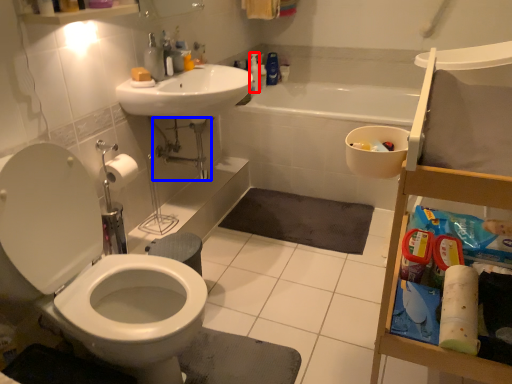
Question: Which point is further to the camera, cleaning product (highlighted by a red box) or plumbing fixture (highlighted by a blue box)?

Choices:
 (A) cleaning product
 (B) plumbing fixture

Answer: (A)